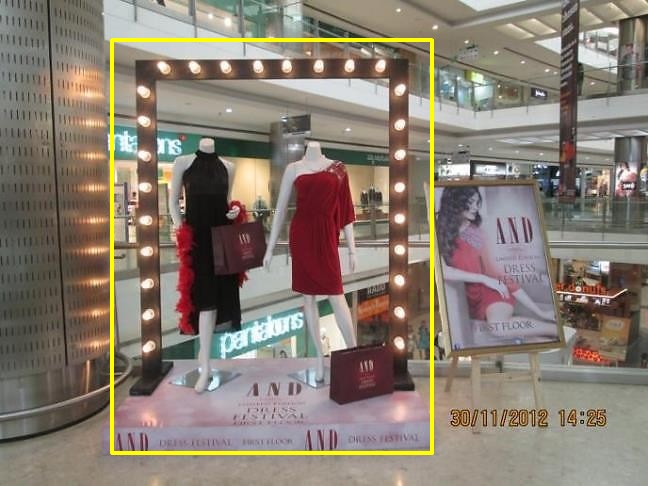
The width and height of the screenshot is (648, 486). What are the coordinates of `frame` in the screenshot? It's located at (522, 348).